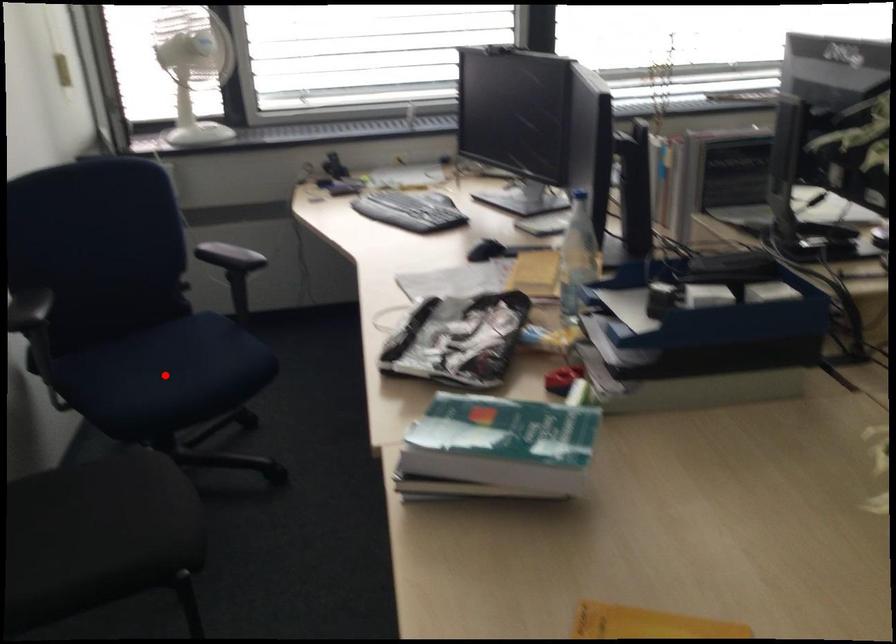
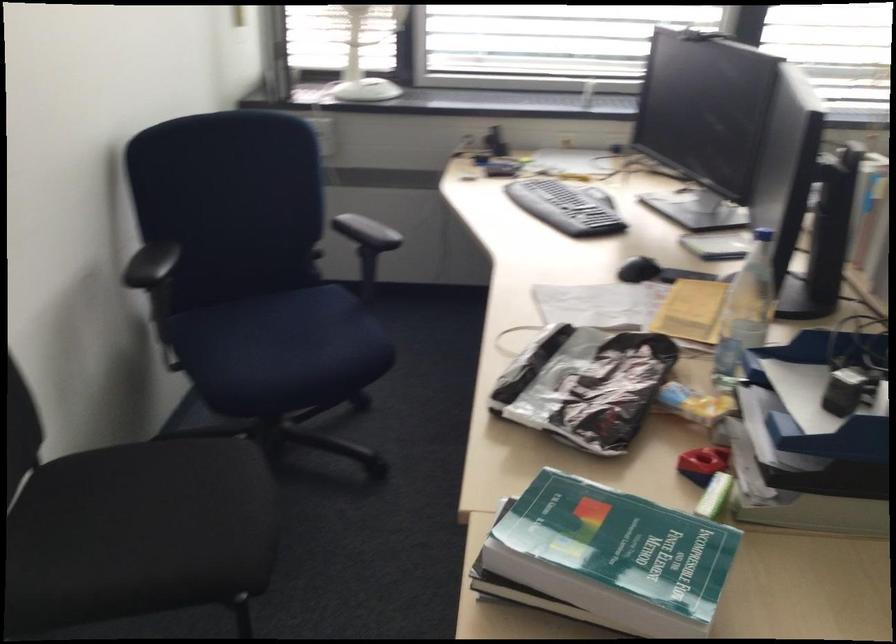
Where in the second image is the point corresponding to the highlighted location from the first image?

(278, 346)